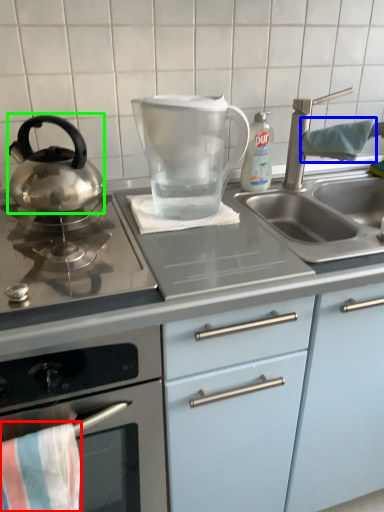
Question: Based on their relative distances, which object is nearer to beach towel (highlighted by a red box)? Choose from beach towel (highlighted by a blue box) and kitchen appliance (highlighted by a green box).

Choices:
 (A) beach towel
 (B) kitchen appliance

Answer: (B)